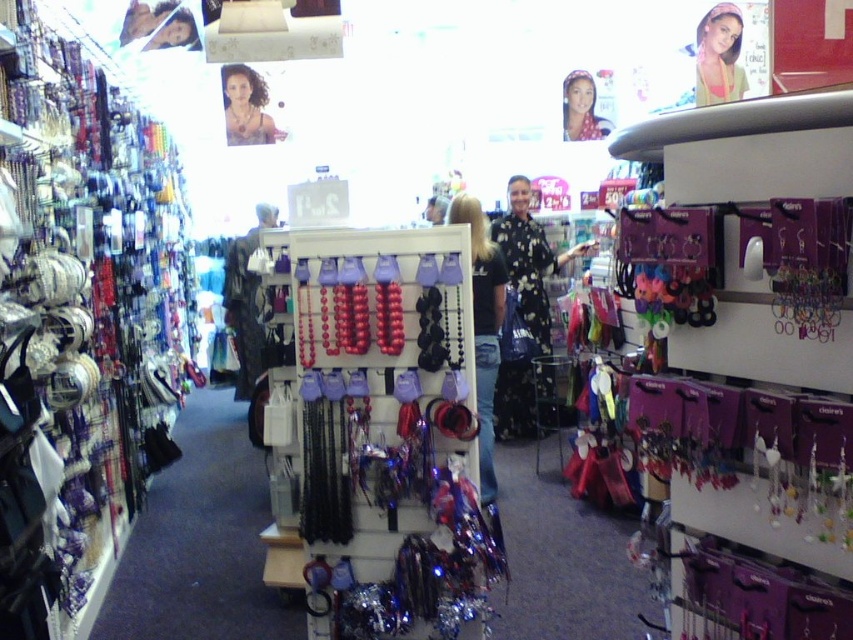
You are a customer in the jewelry store looking for a specific accessory. You see the metallic silver necklaces at left and the matte pink hairband at upper center. Which one is positioned more to the left side of the store?

The metallic silver necklaces at left are positioned more to the left side of the store than the matte pink hairband at upper center.

You are a customer in the jewelry store and want to see both the shiny metallic beads at center and the matte black hair at upper left. Which object would you look at first if you are facing the display from the front?

The matte black hair at upper left is positioned above the shiny metallic beads at center, so you would see the matte black hair at upper left first when looking at the display from the front.

You are a store employee who needs to place a 1.5 meter long decorative banner between the metallic silver necklaces at left and the display stand with necklaces and bracelets in the foreground. Will the banner fit between them?

The metallic silver necklaces at left and the display stand with necklaces and bracelets in the foreground are 1.71 meters apart. Since the banner is 1.5 meters long, it will fit between them with some space to spare.